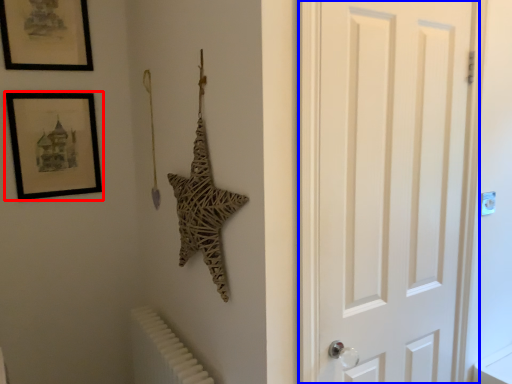
Question: Among these objects, which one is nearest to the camera, picture frame (highlighted by a red box) or door (highlighted by a blue box)?

Choices:
 (A) picture frame
 (B) door

Answer: (B)